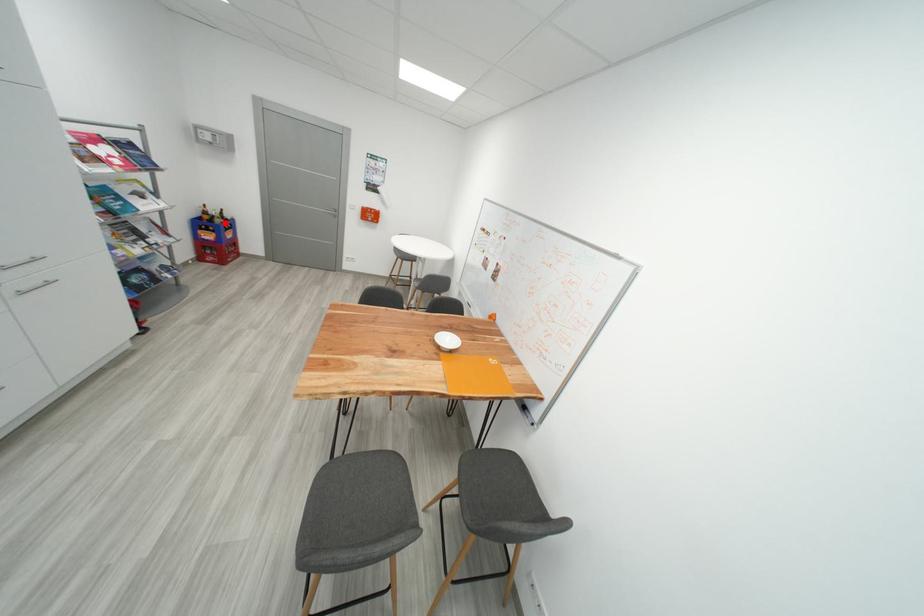
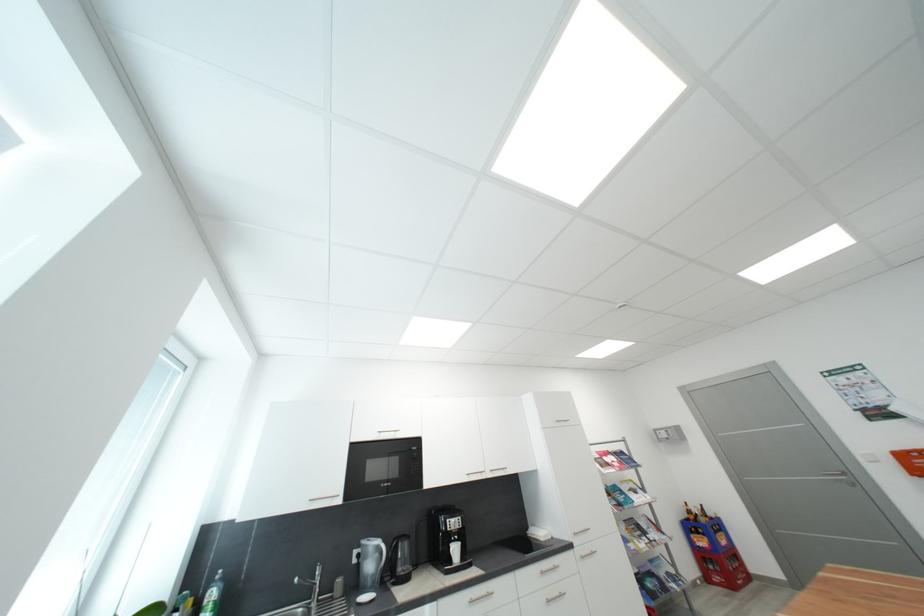
Find the pixel in the second image that matches the highlighted location in the first image.

(710, 522)